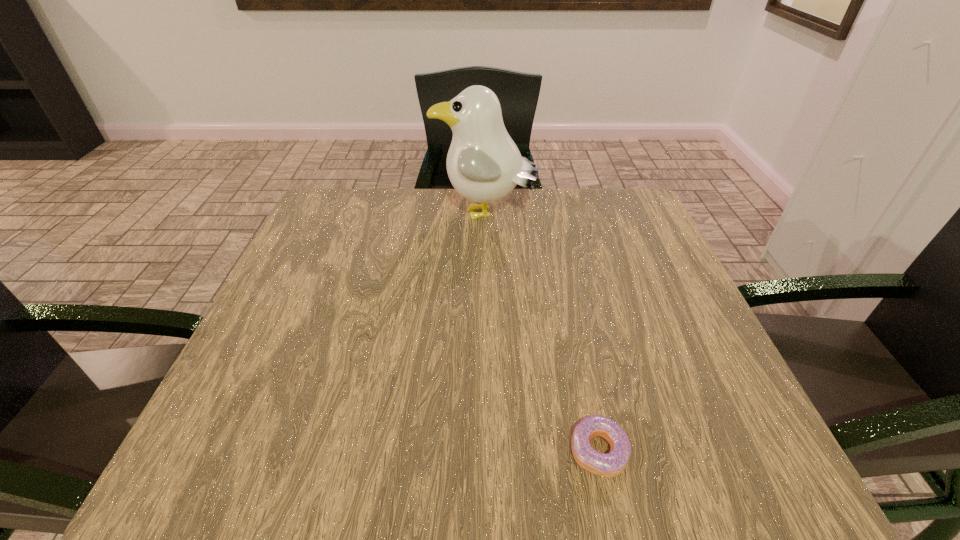
Where is `vacant area that satisfies the following two spatial constraints: 1. on the beak of the farther object; 2. on the back side of the doughnut`? This screenshot has height=540, width=960. vacant area that satisfies the following two spatial constraints: 1. on the beak of the farther object; 2. on the back side of the doughnut is located at coordinates (489, 451).

The width and height of the screenshot is (960, 540). Identify the location of vacant space that satisfies the following two spatial constraints: 1. on the beak of the gull; 2. on the right side of the shorter object. (489, 451).

At what (x,y) coordinates should I click in order to perform the action: click on free spot that satisfies the following two spatial constraints: 1. on the back side of the nearer object; 2. on the beak of the gull. Please return your answer as a coordinate pair (x, y). Looking at the image, I should click on (549, 216).

Where is `free region that satisfies the following two spatial constraints: 1. on the beak of the shorter object; 2. on the left side of the farther object`? Image resolution: width=960 pixels, height=540 pixels. free region that satisfies the following two spatial constraints: 1. on the beak of the shorter object; 2. on the left side of the farther object is located at coordinates (489, 451).

At what (x,y) coordinates should I click in order to perform the action: click on free space that satisfies the following two spatial constraints: 1. on the beak of the farther object; 2. on the back side of the shorter object. Please return your answer as a coordinate pair (x, y). Image resolution: width=960 pixels, height=540 pixels. Looking at the image, I should click on (489, 451).

This screenshot has width=960, height=540. I want to click on free region that satisfies the following two spatial constraints: 1. on the beak of the taller object; 2. on the left side of the nearer object, so click(489, 451).

Locate an element on the screen. The height and width of the screenshot is (540, 960). vacant space that satisfies the following two spatial constraints: 1. on the beak of the taller object; 2. on the right side of the nearer object is located at coordinates (489, 451).

Where is `vacant space that satisfies the following two spatial constraints: 1. on the beak of the shorter object; 2. on the left side of the gull`? vacant space that satisfies the following two spatial constraints: 1. on the beak of the shorter object; 2. on the left side of the gull is located at coordinates (489, 451).

Locate an element on the screen. The width and height of the screenshot is (960, 540). vacant space that satisfies the following two spatial constraints: 1. on the beak of the taller object; 2. on the left side of the doughnut is located at coordinates (489, 451).

The image size is (960, 540). I want to click on vacant region that satisfies the following two spatial constraints: 1. on the beak of the taller object; 2. on the left side of the doughnut, so click(x=489, y=451).